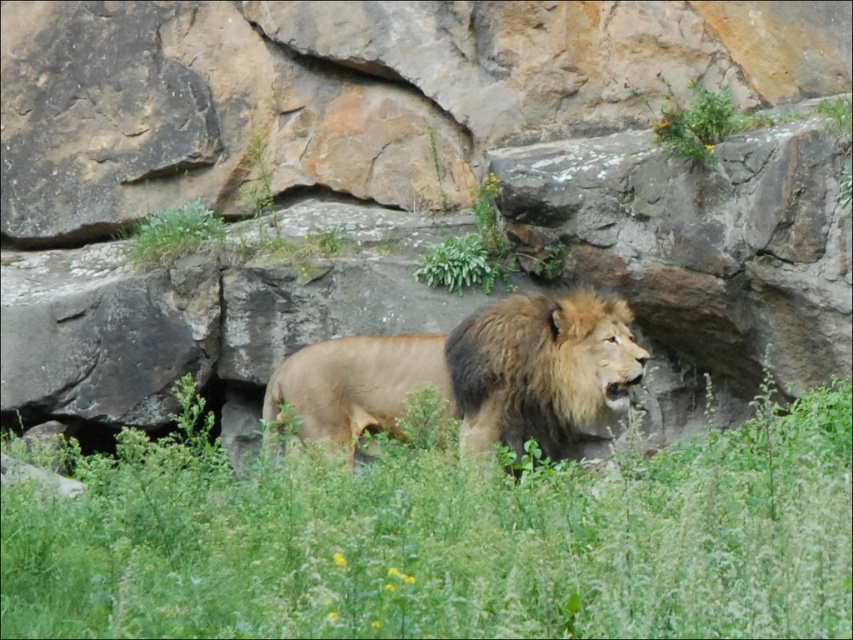
Question: Is green grassy at center below golden fur lion at center?

Choices:
 (A) yes
 (B) no

Answer: (A)

Question: Does green grassy at center appear on the left side of golden fur lion at center?

Choices:
 (A) no
 (B) yes

Answer: (A)

Question: Is green grassy at center above golden fur lion at center?

Choices:
 (A) no
 (B) yes

Answer: (A)

Question: Which of the following is the farthest from the observer?

Choices:
 (A) (607, 337)
 (B) (440, 620)

Answer: (A)